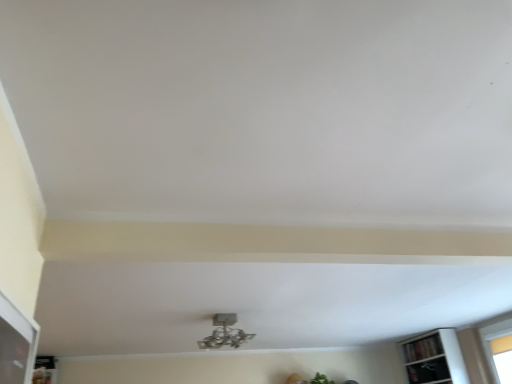
Question: Is metallic silver chandelier at center closer to the viewer compared to wooden bookshelf at lower right?

Choices:
 (A) yes
 (B) no

Answer: (A)

Question: Does metallic silver chandelier at center touch wooden bookshelf at lower right?

Choices:
 (A) yes
 (B) no

Answer: (B)

Question: Could you tell me if metallic silver chandelier at center is facing wooden bookshelf at lower right?

Choices:
 (A) no
 (B) yes

Answer: (A)

Question: Does metallic silver chandelier at center have a greater width compared to wooden bookshelf at lower right?

Choices:
 (A) yes
 (B) no

Answer: (A)

Question: Is metallic silver chandelier at center at the left side of wooden bookshelf at lower right?

Choices:
 (A) yes
 (B) no

Answer: (A)

Question: Is metallic silver chandelier at center turned away from wooden bookshelf at lower right?

Choices:
 (A) no
 (B) yes

Answer: (B)

Question: Can you confirm if wooden bookshelf at lower right is shorter than metallic silver chandelier at center?

Choices:
 (A) no
 (B) yes

Answer: (B)

Question: Considering the relative sizes of wooden bookshelf at lower right and metallic silver chandelier at center in the image provided, is wooden bookshelf at lower right smaller than metallic silver chandelier at center?

Choices:
 (A) yes
 (B) no

Answer: (A)

Question: Is wooden bookshelf at lower right positioned before metallic silver chandelier at center?

Choices:
 (A) yes
 (B) no

Answer: (B)

Question: Are wooden bookshelf at lower right and metallic silver chandelier at center beside each other?

Choices:
 (A) no
 (B) yes

Answer: (A)

Question: Does wooden bookshelf at lower right have a greater width compared to metallic silver chandelier at center?

Choices:
 (A) yes
 (B) no

Answer: (B)

Question: Is wooden bookshelf at lower right to the left of metallic silver chandelier at center from the viewer's perspective?

Choices:
 (A) no
 (B) yes

Answer: (A)

Question: From the image's perspective, is metallic silver chandelier at center located above or below wooden bookshelf at lower right?

Choices:
 (A) below
 (B) above

Answer: (B)